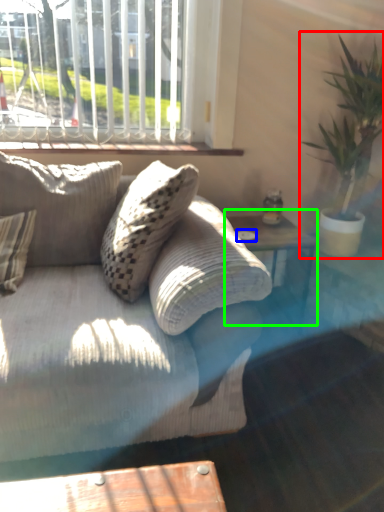
Question: Considering the real-world distances, which object is closest to houseplant (highlighted by a red box)? glass plate (highlighted by a blue box) or table (highlighted by a green box).

Choices:
 (A) glass plate
 (B) table

Answer: (B)